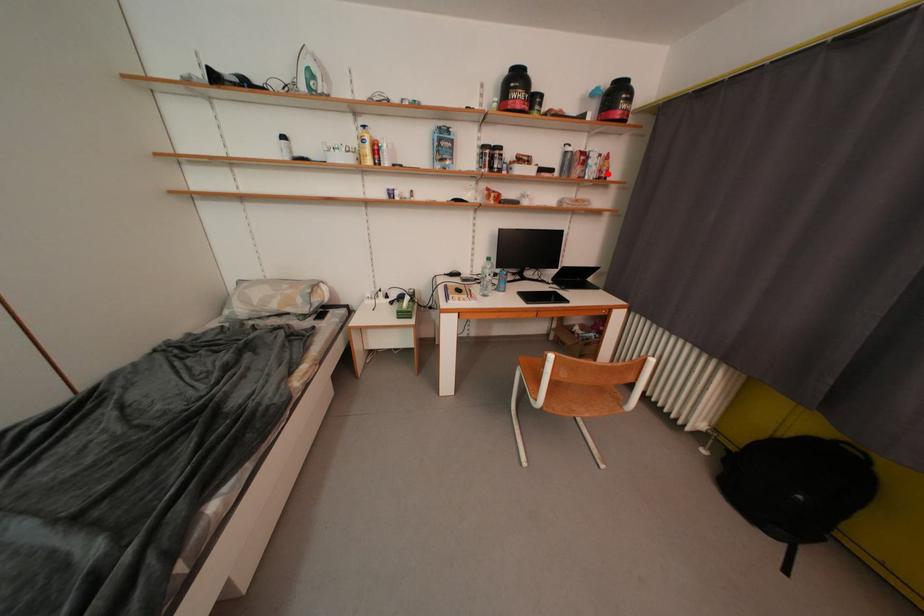
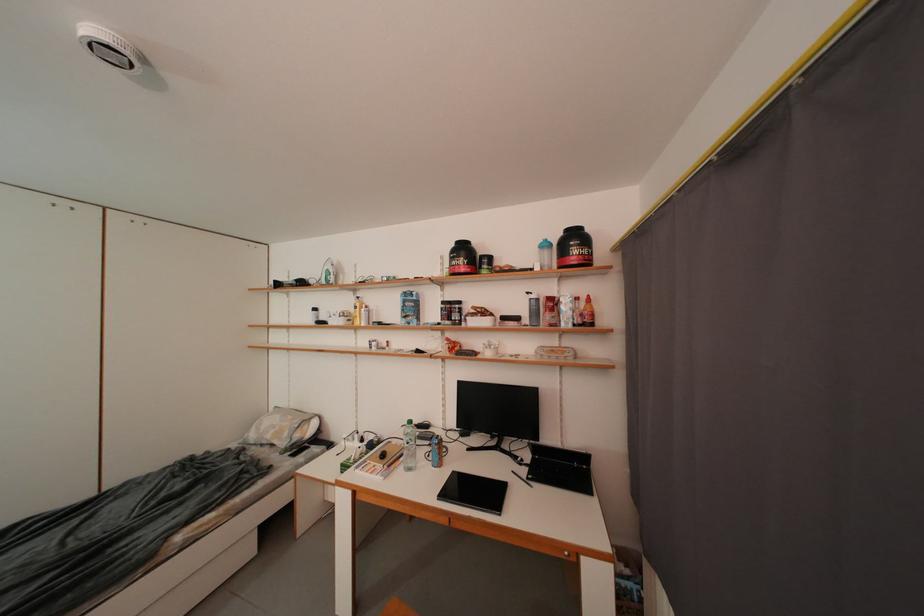
Question: I am providing you with two images of the same scene from different viewpoints. A red point is shown in image1. For the corresponding object point in image2, is it positioned nearer or farther from the camera?

Choices:
 (A) Nearer
 (B) Farther

Answer: (B)